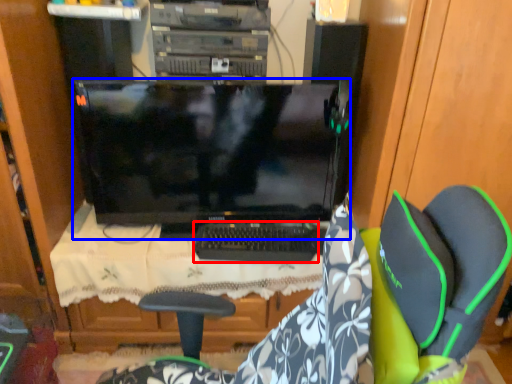
Question: Among these objects, which one is nearest to the camera, computer keyboard (highlighted by a red box) or computer monitor (highlighted by a blue box)?

Choices:
 (A) computer keyboard
 (B) computer monitor

Answer: (B)